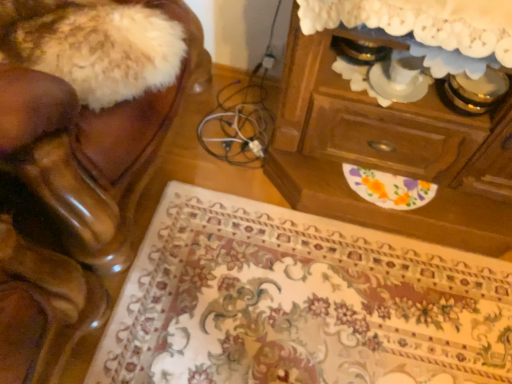
Question: Is point (138, 316) positioned closer to the camera than point (274, 162)?

Choices:
 (A) closer
 (B) farther

Answer: (A)

Question: Is floral carpet at lower center inside or outside of wooden chest of drawers at upper right?

Choices:
 (A) outside
 (B) inside

Answer: (A)

Question: Considering the real-world distances, which object is farthest from the floral carpet at lower center?

Choices:
 (A) shiny brown leather chair at left
 (B) wooden chest of drawers at upper right

Answer: (A)

Question: Which of these objects is positioned closest to the wooden chest of drawers at upper right?

Choices:
 (A) floral carpet at lower center
 (B) shiny brown leather chair at left

Answer: (A)